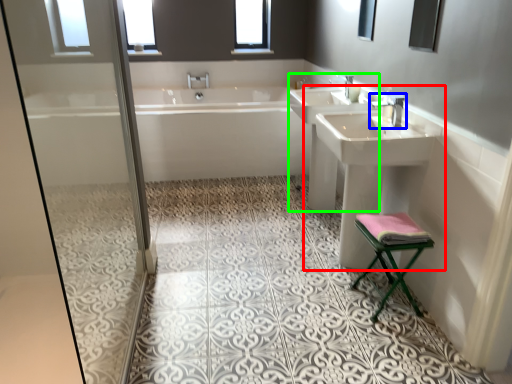
Question: Which object is positioned farthest from sink (highlighted by a red box)? Select from tap (highlighted by a blue box) and sink (highlighted by a green box).

Choices:
 (A) tap
 (B) sink

Answer: (A)